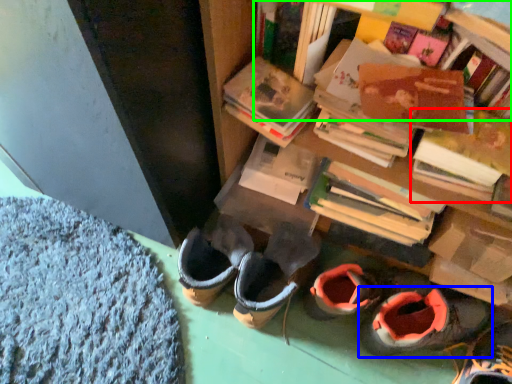
Question: Which object is positioned farthest from book (highlighted by a red box)? Select from footwear (highlighted by a blue box) and shelf (highlighted by a green box).

Choices:
 (A) footwear
 (B) shelf

Answer: (A)